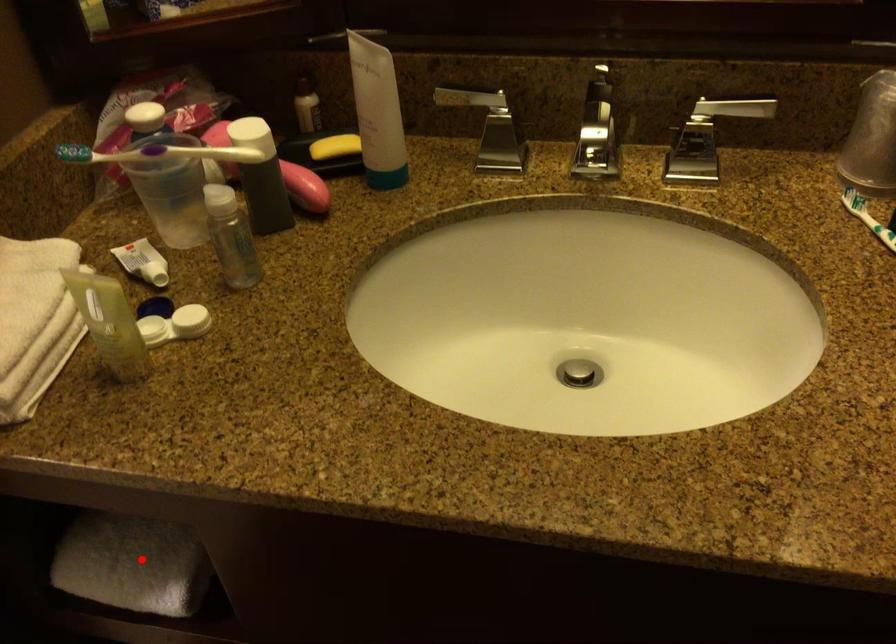
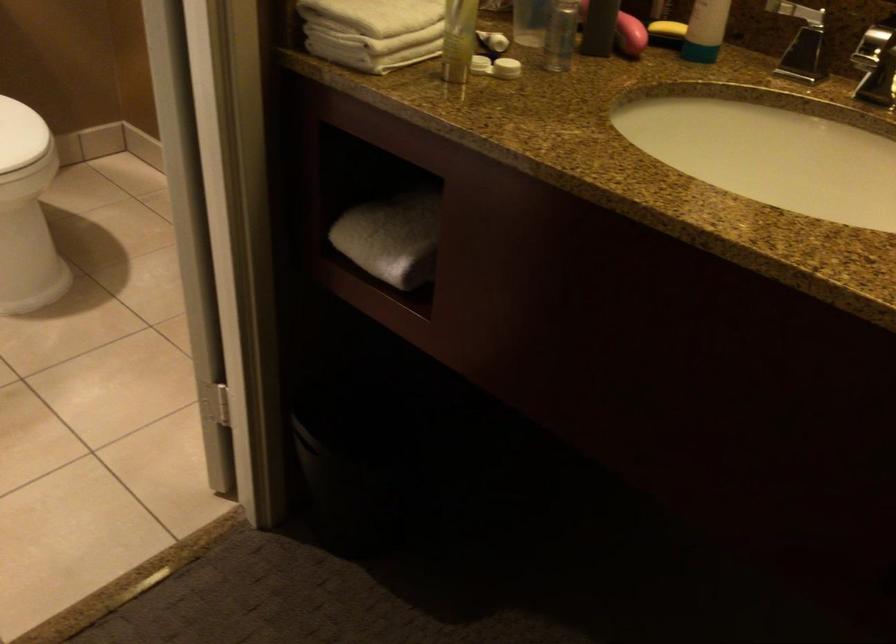
Find the pixel in the second image that matches the highlighted location in the first image.

(392, 238)